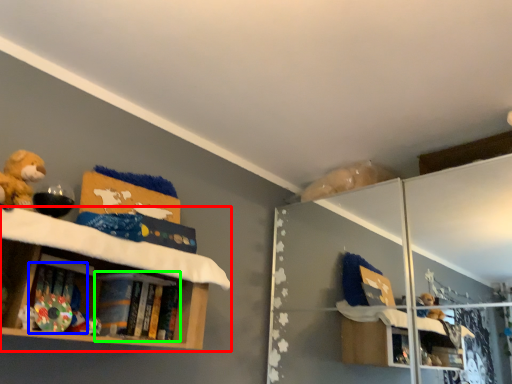
Question: Which object is positioned closest to shelf (highlighted by a red box)? Select from book (highlighted by a blue box) and book (highlighted by a green box).

Choices:
 (A) book
 (B) book

Answer: (B)